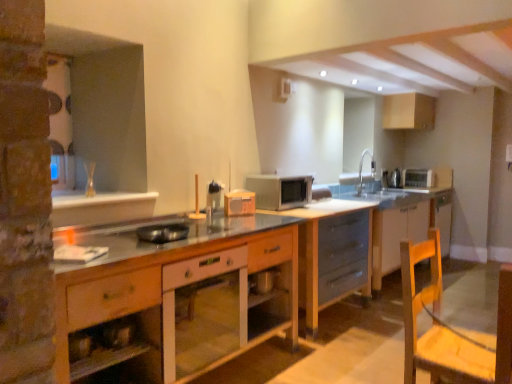
Question: Can you confirm if wooden swivel chair at lower right is thinner than white matte exhaust hood at upper center?

Choices:
 (A) no
 (B) yes

Answer: (A)

Question: Is wooden swivel chair at lower right aimed at white matte exhaust hood at upper center?

Choices:
 (A) yes
 (B) no

Answer: (B)

Question: Can you confirm if wooden swivel chair at lower right is bigger than white matte exhaust hood at upper center?

Choices:
 (A) no
 (B) yes

Answer: (B)

Question: Is wooden swivel chair at lower right directly adjacent to white matte exhaust hood at upper center?

Choices:
 (A) no
 (B) yes

Answer: (A)

Question: Considering the relative sizes of wooden swivel chair at lower right and white matte exhaust hood at upper center in the image provided, is wooden swivel chair at lower right taller than white matte exhaust hood at upper center?

Choices:
 (A) yes
 (B) no

Answer: (A)

Question: Would you say white matte exhaust hood at upper center is part of wooden swivel chair at lower right's contents?

Choices:
 (A) no
 (B) yes

Answer: (A)

Question: Can you confirm if matte gray cabinet at center, marked as the second cabinetry in a back-to-front arrangement, is wider than metallic silver pan at center, which is the fourth appliance from back to front?

Choices:
 (A) no
 (B) yes

Answer: (B)

Question: Can you see matte gray cabinet at center, marked as the second cabinetry in a back-to-front arrangement, touching metallic silver pan at center, the first appliance from the left?

Choices:
 (A) yes
 (B) no

Answer: (B)

Question: Is matte gray cabinet at center, marked as the second cabinetry in a back-to-front arrangement, at the right side of metallic silver pan at center, acting as the fourth appliance starting from the right?

Choices:
 (A) no
 (B) yes

Answer: (B)

Question: Is matte gray cabinet at center, which is counted as the third cabinetry, starting from the front, aimed at metallic silver pan at center, the 1th appliance positioned from the front?

Choices:
 (A) yes
 (B) no

Answer: (B)

Question: From the image's perspective, is matte gray cabinet at center, marked as the second cabinetry in a back-to-front arrangement, on top of metallic silver pan at center, the 1th appliance positioned from the front?

Choices:
 (A) yes
 (B) no

Answer: (B)

Question: Does matte gray cabinet at center, the 2th cabinetry when ordered from right to left, have a lesser width compared to metallic silver pan at center, the 1th appliance positioned from the front?

Choices:
 (A) no
 (B) yes

Answer: (A)

Question: From the image's perspective, would you say wooden cabinet at center, the first cabinetry viewed from the front, is shown under silver metallic toaster at upper right, which appears as the 4th appliance when viewed from the left?

Choices:
 (A) no
 (B) yes

Answer: (B)